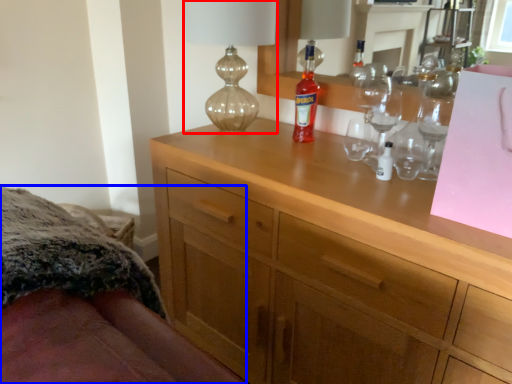
Question: Among these objects, which one is nearest to the camera, table lamp (highlighted by a red box) or bed (highlighted by a blue box)?

Choices:
 (A) table lamp
 (B) bed

Answer: (B)